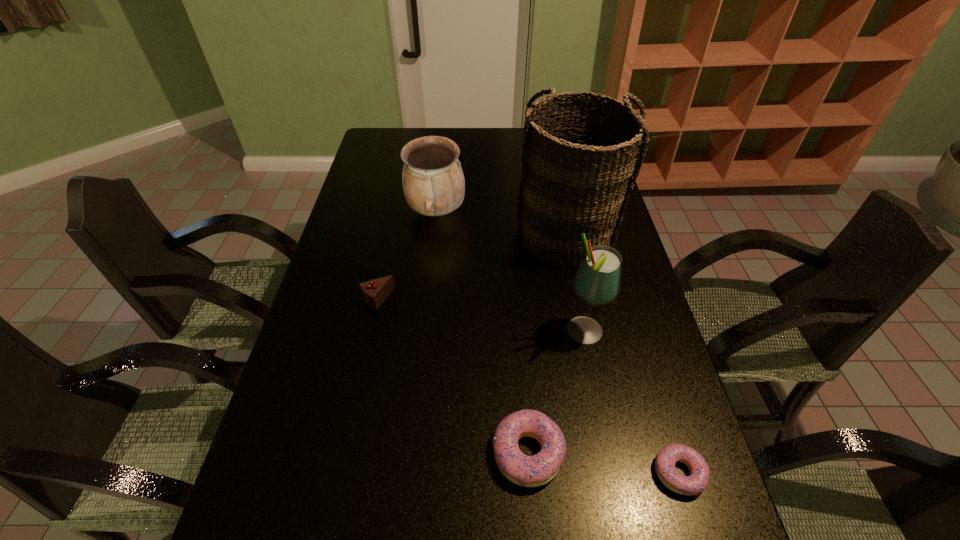
At what (x,y) coordinates should I click in order to perform the action: click on free space between the left doughnut and the urn. Please return your answer as a coordinate pair (x, y). The height and width of the screenshot is (540, 960). Looking at the image, I should click on (483, 332).

This screenshot has height=540, width=960. Identify the location of free spot between the shortest object and the chocolate cake. (528, 386).

At what (x,y) coordinates should I click in order to perform the action: click on free space between the chocolate cake and the shortest object. Please return your answer as a coordinate pair (x, y). Looking at the image, I should click on (528, 386).

Where is `free space between the right doughnut and the third farthest object`? free space between the right doughnut and the third farthest object is located at coordinates (528, 386).

Identify the location of vacant space that's between the fourth nearest object and the basket. This screenshot has width=960, height=540. (471, 268).

Find the location of a particular element. object identified as the second closest to the chocolate cake is located at coordinates (579, 163).

Find the location of a particular element. This screenshot has width=960, height=540. object that stands as the closest to the fourth nearest object is located at coordinates (433, 181).

The height and width of the screenshot is (540, 960). What are the coordinates of `free point that satisfies the following two spatial constraints: 1. on the front side of the shortest object; 2. on the left side of the basket` in the screenshot? It's located at (612, 472).

What are the coordinates of `vacant space that satisfies the following two spatial constraints: 1. on the front side of the tallest object; 2. on the right side of the shortest object` in the screenshot? It's located at (612, 472).